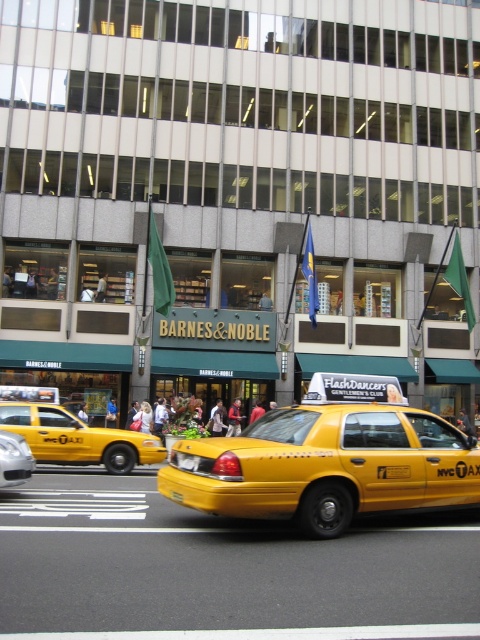
Question: Which of the following is the closest to the observer?

Choices:
 (A) silver metallic sedan at center
 (B) yellow matte taxi at center

Answer: (B)

Question: Does yellow rubber taxi cab at center appear under silver metallic sedan at center?

Choices:
 (A) no
 (B) yes

Answer: (B)

Question: Can you confirm if yellow matte taxi at center is bigger than yellow rubber taxi cab at center?

Choices:
 (A) yes
 (B) no

Answer: (B)

Question: Is yellow matte taxi at center to the left of yellow rubber taxi cab at center from the viewer's perspective?

Choices:
 (A) no
 (B) yes

Answer: (A)

Question: Which point is closer to the camera?

Choices:
 (A) silver metallic sedan at center
 (B) yellow rubber taxi cab at center
 (C) yellow matte taxi at center

Answer: (C)

Question: Which object is positioned closest to the silver metallic sedan at center?

Choices:
 (A) yellow rubber taxi cab at center
 (B) yellow matte taxi at center

Answer: (B)